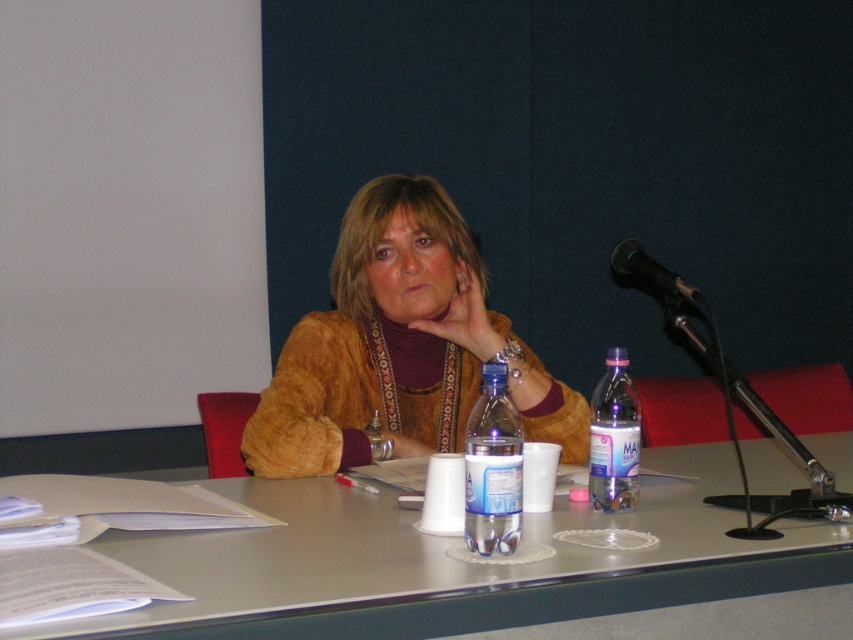
Between point (444, 214) and point (480, 365), which one is positioned behind?

The point (444, 214) is more distant.

Which is in front, point (509, 374) or point (485, 456)?

Point (485, 456) is in front.

Image resolution: width=853 pixels, height=640 pixels. I want to click on suede-like brown jacket at center, so click(x=399, y=346).

Describe the element at coordinates (614, 436) in the screenshot. I see `translucent plastic bottle at right` at that location.

Does translucent plastic bottle at right have a lesser width compared to black metallic microphone at upper right?

Correct, translucent plastic bottle at right's width is less than black metallic microphone at upper right's.

Who is more forward, (x=590, y=490) or (x=622, y=244)?

Point (x=590, y=490) is in front.

You are a GUI agent. You are given a task and a screenshot of the screen. Output one action in this format:
    pyautogui.click(x=<x>, y=<y>)
    Task: Click on the translucent plastic bottle at right
    The image size is (853, 640).
    Given the screenshot: What is the action you would take?
    pyautogui.click(x=614, y=436)

Between metallic gray table at center and suede-like brown jacket at center, which one appears on the left side from the viewer's perspective?

suede-like brown jacket at center

Locate an element on the screen. metallic gray table at center is located at coordinates (450, 563).

Is point (253, 625) closer to viewer compared to point (300, 369)?

That is True.

Where is `metallic gray table at center`? metallic gray table at center is located at coordinates (450, 563).